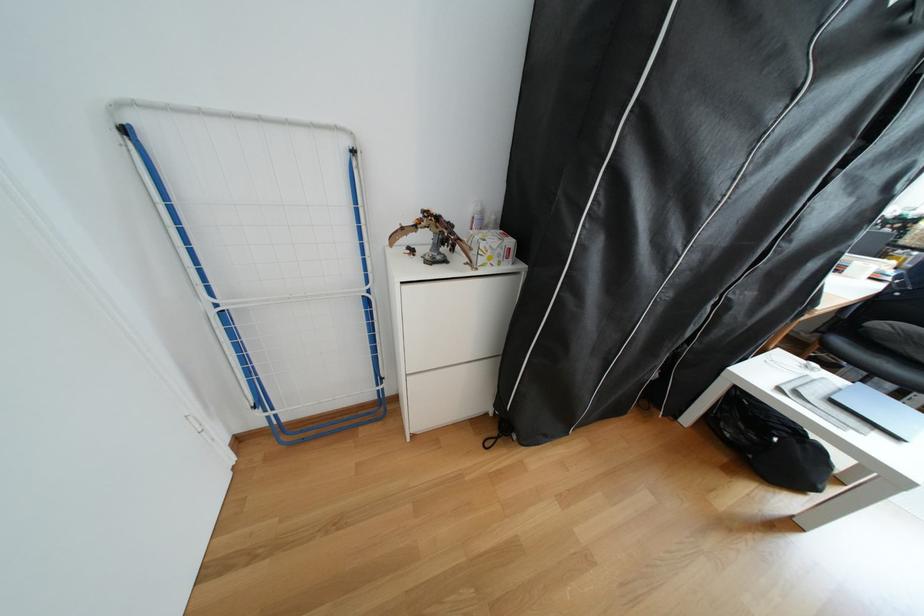
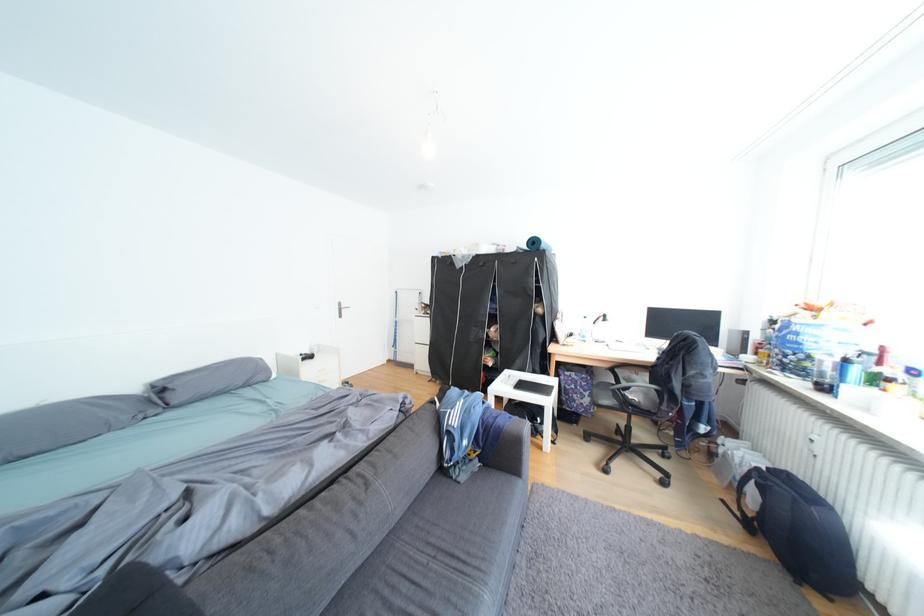
Question: I am providing you with two images of the same scene from different viewpoints. After the viewpoint changes to image2, which objects are now occluded?

Choices:
 (A) red bottle pump
 (B) white cabinet drawer
 (C) green sofa surface
 (D) white drying rack

Answer: (D)